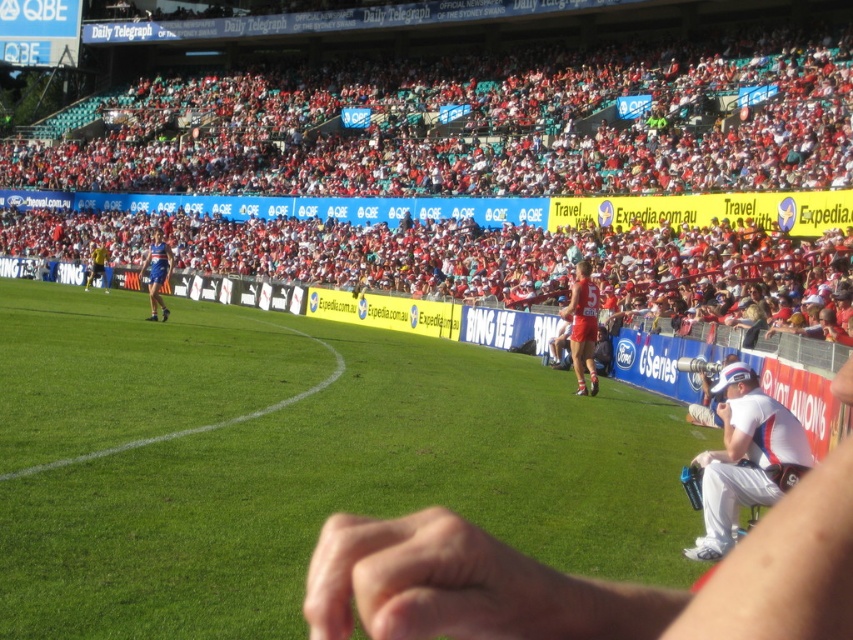
Is point (583, 365) positioned before point (143, 268)?

Yes, it is.

Can you confirm if red jersey at center is wider than blue fabric jersey at left?

In fact, red jersey at center might be narrower than blue fabric jersey at left.

I want to click on red jersey at center, so click(583, 326).

At what (x,y) coordinates should I click in order to perform the action: click on red jersey at center. Please return your answer as a coordinate pair (x, y). Image resolution: width=853 pixels, height=640 pixels. Looking at the image, I should click on [583, 326].

Does green grass at center lie in front of red fabric seats at upper center?

Yes, green grass at center is closer to the viewer.

Does point (41, 589) come behind point (630, 189)?

No, (41, 589) is in front of (630, 189).

What do you see at coordinates (293, 460) in the screenshot?
I see `green grass at center` at bounding box center [293, 460].

Identify the location of green grass at center. (293, 460).

What are the coordinates of `red fabric seats at upper center` in the screenshot? It's located at (479, 125).

Consider the image. Who is taller, red fabric seats at upper center or white fabric cap at right?

With more height is red fabric seats at upper center.

Does point (132, 182) come closer to viewer compared to point (770, 406)?

No, (132, 182) is behind (770, 406).

You are a GUI agent. You are given a task and a screenshot of the screen. Output one action in this format:
    pyautogui.click(x=<x>, y=<y>)
    Task: Click on the red fabric seats at upper center
    
    Given the screenshot: What is the action you would take?
    pyautogui.click(x=479, y=125)